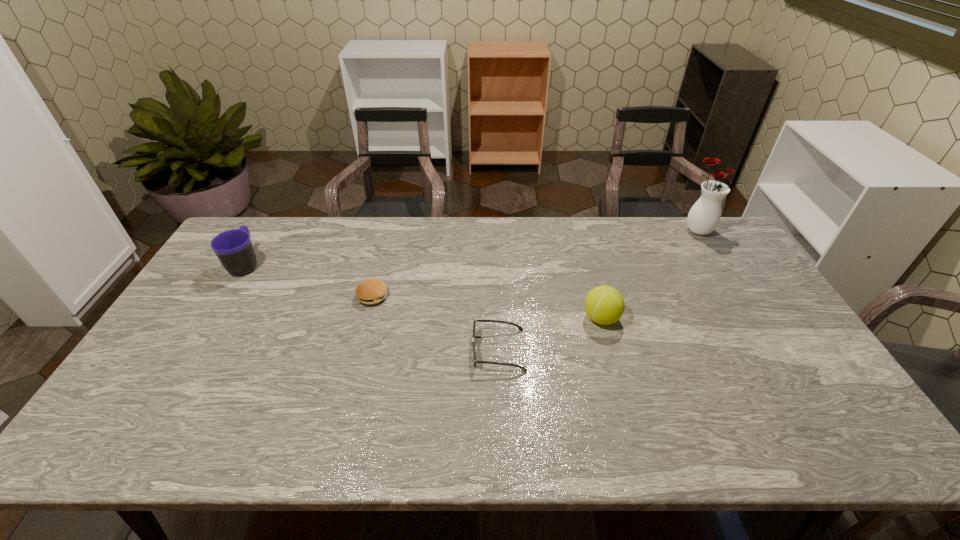
Image resolution: width=960 pixels, height=540 pixels. What are the coordinates of `free space located with the handle on the side of the leftmost object` in the screenshot? It's located at (267, 229).

The width and height of the screenshot is (960, 540). Identify the location of vacant space located on the left of the fourth object from left to right. (499, 319).

The height and width of the screenshot is (540, 960). In order to click on vacant region located 0.130m on the face of the spectacles in this screenshot , I will do `click(423, 350)`.

This screenshot has width=960, height=540. I want to click on free location located 0.380m on the face of the spectacles, so click(x=331, y=350).

Locate an element on the screen. This screenshot has height=540, width=960. free space located 0.210m on the face of the spectacles is located at coordinates coord(395,350).

The image size is (960, 540). Find the location of `vacant space situated 0.190m on the back of the patty`. vacant space situated 0.190m on the back of the patty is located at coordinates (385, 248).

Where is `vase that is at the far edge`? The width and height of the screenshot is (960, 540). vase that is at the far edge is located at coordinates (704, 216).

Where is `mug that is at the far edge`? The height and width of the screenshot is (540, 960). mug that is at the far edge is located at coordinates (234, 249).

At what (x,y) coordinates should I click in order to perform the action: click on object situated at the left edge. Please return your answer as a coordinate pair (x, y). Image resolution: width=960 pixels, height=540 pixels. Looking at the image, I should click on (234, 249).

This screenshot has width=960, height=540. I want to click on object that is at the right edge, so click(x=704, y=216).